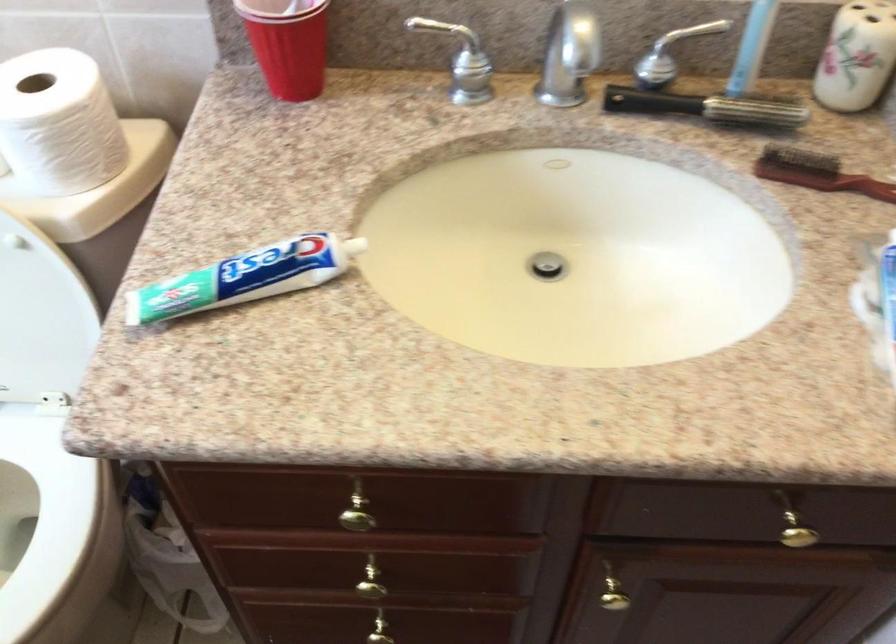
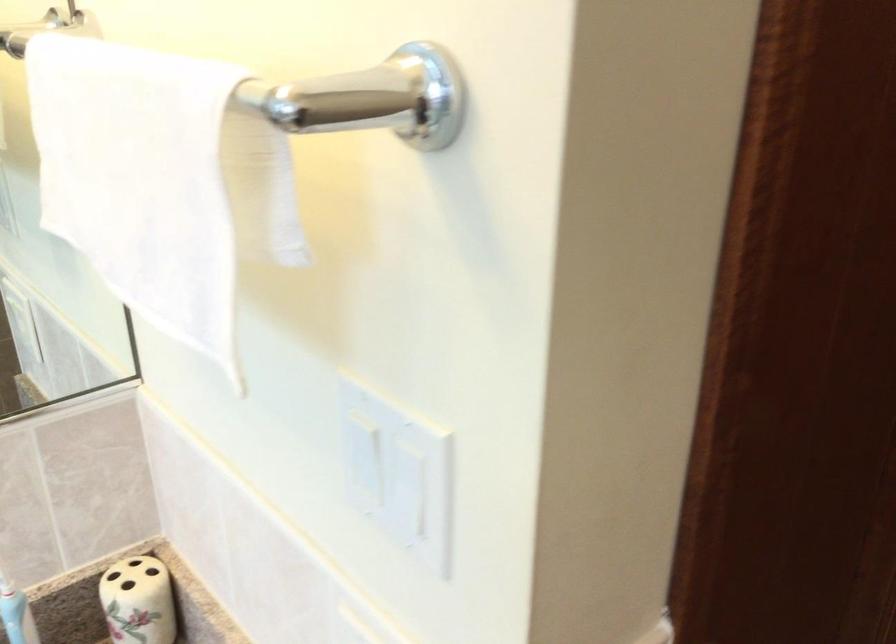
Question: The first image is from the beginning of the video and the second image is from the end. How did the camera likely rotate when shooting the video?

Choices:
 (A) Left
 (B) Right
 (C) Up
 (D) Down

Answer: (B)